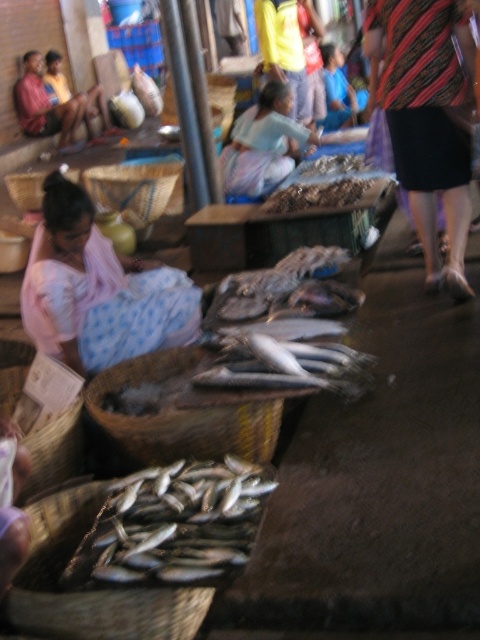
Is brown woven basket at lower left to the left of brown woven basket at left from the viewer's perspective?

In fact, brown woven basket at lower left is to the right of brown woven basket at left.

Is brown woven basket at lower left bigger than brown woven basket at left?

No, brown woven basket at lower left is not bigger than brown woven basket at left.

Which is in front, point (48, 536) or point (40, 189)?

Positioned in front is point (48, 536).

Identify the location of brown woven basket at lower left. (91, 589).

Between point (271, 132) and point (136, 182), which one is positioned in front?

Point (136, 182) is more forward.

How far apart are light blue fabric at center and woven bamboo basket at center?

They are 33.36 inches apart.

Is point (263, 96) in front of point (149, 186)?

That is False.

Find the location of a particular element. light blue fabric at center is located at coordinates (263, 145).

Looking at this image, is woven bamboo basket at lower left to the left of brown woven basket at left from the viewer's perspective?

→ In fact, woven bamboo basket at lower left is to the right of brown woven basket at left.

Who is shorter, woven bamboo basket at lower left or brown woven basket at left?

Standing shorter between the two is woven bamboo basket at lower left.

Between point (57, 460) and point (17, 200), which one is positioned in front?

Point (57, 460) is more forward.

Locate an element on the screen. woven bamboo basket at lower left is located at coordinates (54, 451).